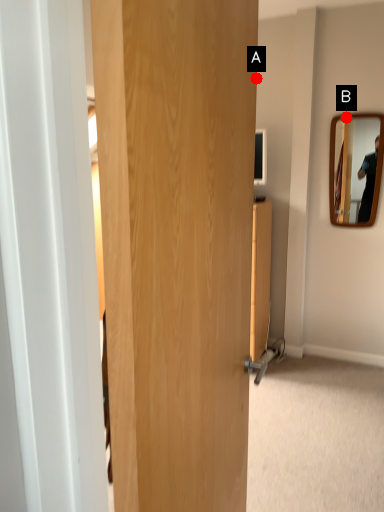
Question: Two points are circled on the image, labeled by A and B beside each circle. Which point is closer to the camera?

Choices:
 (A) A is closer
 (B) B is closer

Answer: (B)